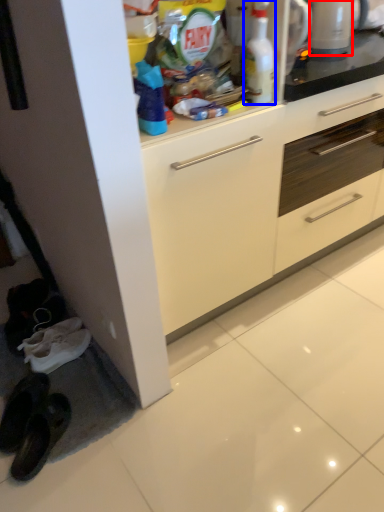
Question: Which object is closer to the camera taking this photo, appliance (highlighted by a red box) or cleaning product (highlighted by a blue box)?

Choices:
 (A) appliance
 (B) cleaning product

Answer: (B)